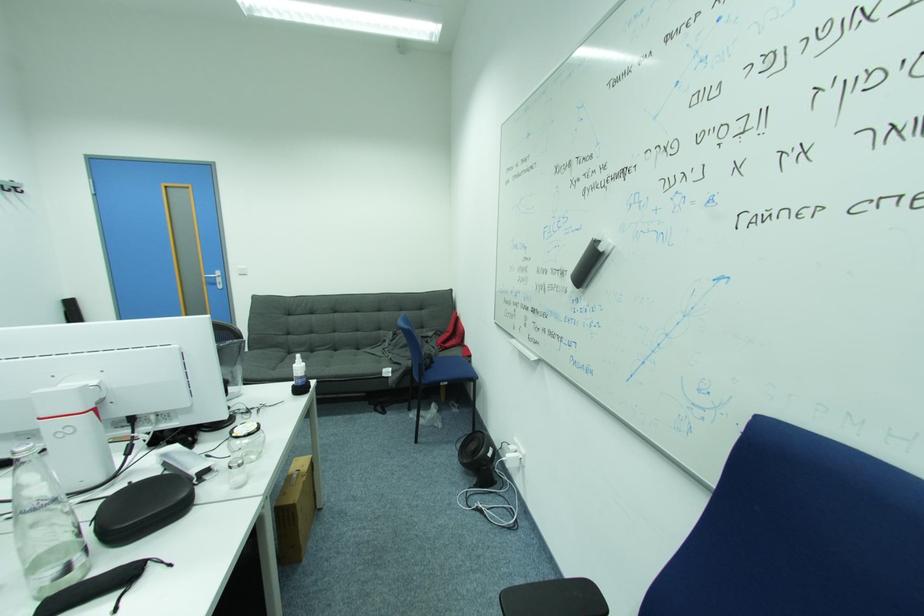
Find where to lift the black whiteboard eraser. Please return your answer as a coordinate pair (x, y).

(590, 262)